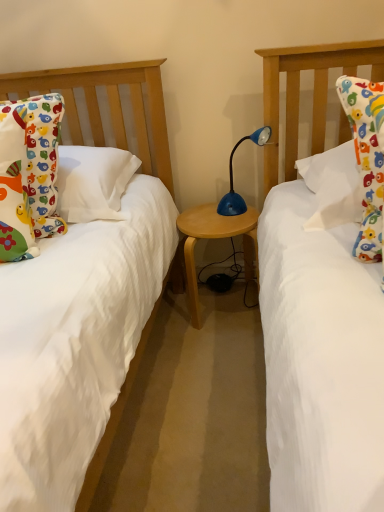
You are a GUI agent. You are given a task and a screenshot of the screen. Output one action in this format:
    pyautogui.click(x=<x>, y=<y>)
    Task: Click on the empty space that is ontop of wooden table at center (from a real-world perspective)
    Image resolution: width=384 pixels, height=512 pixels.
    Given the screenshot: What is the action you would take?
    pyautogui.click(x=221, y=215)